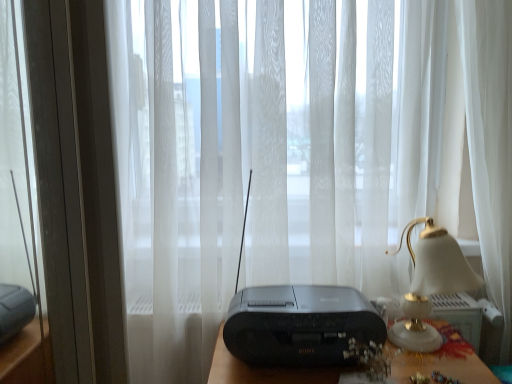
Find the location of a particular element. The height and width of the screenshot is (384, 512). matte gold lampshade at right is located at coordinates (430, 284).

You are a GUI agent. You are given a task and a screenshot of the screen. Output one action in this format:
    pyautogui.click(x=<x>, y=<y>)
    Task: Click on the black plastic radio at center
    This screenshot has width=512, height=384.
    Given the screenshot: What is the action you would take?
    pyautogui.click(x=298, y=322)

What is the approximate width of black plastic radio at center?

black plastic radio at center is 9.27 inches in width.

Where is `matte gold lampshade at right`? Image resolution: width=512 pixels, height=384 pixels. matte gold lampshade at right is located at coordinates (430, 284).

From the image's perspective, would you say matte gold lampshade at right is shown under black plastic radio at center?

Indeed, from the image's perspective, matte gold lampshade at right is shown beneath black plastic radio at center.

What's the angular difference between matte gold lampshade at right and black plastic radio at center's facing directions?

0.00258 degrees separate the facing orientations of matte gold lampshade at right and black plastic radio at center.

Considering the sizes of matte gold lampshade at right and black plastic radio at center in the image, is matte gold lampshade at right taller or shorter than black plastic radio at center?

Clearly, matte gold lampshade at right is shorter compared to black plastic radio at center.

Where is `gadget above the matte gold lampshade at right (from the image's perspective)`? The image size is (512, 384). gadget above the matte gold lampshade at right (from the image's perspective) is located at coordinates (298, 322).

Could you tell me if matte gold lampshade at right is turned towards transparent glass door at left?

No, matte gold lampshade at right is not turned towards transparent glass door at left.

Locate an element on the screen. table lamp located on the right of transparent glass door at left is located at coordinates (430, 284).

From the image's perspective, is black plastic radio at center positioned above or below matte gold lampshade at right?

Clearly, from the image's perspective, black plastic radio at center is above matte gold lampshade at right.

How many degrees apart are the facing directions of black plastic radio at center and matte gold lampshade at right?

The facing directions of black plastic radio at center and matte gold lampshade at right are 0.00258 degrees apart.

From a real-world perspective, is black plastic radio at center on top of matte gold lampshade at right?

Yes, from a real-world perspective, black plastic radio at center is over matte gold lampshade at right

In the image, there is a black plastic radio at center. Where is `table lamp below it (from a real-world perspective)`? The height and width of the screenshot is (384, 512). table lamp below it (from a real-world perspective) is located at coordinates [x=430, y=284].

Is transparent glass door at left positioned behind black plastic radio at center?

Yes, transparent glass door at left is further from the camera.

Considering the sizes of objects transparent glass door at left and black plastic radio at center in the image provided, who is taller, transparent glass door at left or black plastic radio at center?

Standing taller between the two is transparent glass door at left.

Does point (28, 153) come behind point (370, 305)?

No, it is in front of (370, 305).

Would you say matte gold lampshade at right is outside black plastic radio at center?

matte gold lampshade at right is positioned outside black plastic radio at center.

From the image's perspective, relative to black plastic radio at center, is matte gold lampshade at right above or below?

From the image's perspective, matte gold lampshade at right appears above black plastic radio at center.

Measure the distance from matte gold lampshade at right to black plastic radio at center.

The distance of matte gold lampshade at right from black plastic radio at center is 9.03 inches.

Identify the location of table lamp above the black plastic radio at center (from a real-world perspective). The height and width of the screenshot is (384, 512). (430, 284).

Is transparent glass door at left wider or thinner than black plastic radio at center?

transparent glass door at left is thinner than black plastic radio at center.

Would you say transparent glass door at left is inside or outside black plastic radio at center?

transparent glass door at left is outside black plastic radio at center.

Considering the relative sizes of transparent glass door at left and black plastic radio at center in the image provided, is transparent glass door at left smaller than black plastic radio at center?

No.

Can you confirm if black plastic radio at center is bigger than transparent glass door at left?

No.

From a real-world perspective, is black plastic radio at center physically located above or below transparent glass door at left?

In terms of real-world spatial position, black plastic radio at center is below transparent glass door at left.

Is black plastic radio at center at the left side of transparent glass door at left?

No.

Does black plastic radio at center have a greater width compared to transparent glass door at left?

Yes, black plastic radio at center is wider than transparent glass door at left.

The image size is (512, 384). What are the coordinates of `table lamp that is below the black plastic radio at center (from the image's perspective)` in the screenshot? It's located at (430, 284).

Image resolution: width=512 pixels, height=384 pixels. In order to click on table lamp that is on the right side of transparent glass door at left in this screenshot , I will do `click(430, 284)`.

Considering their positions, is transparent glass door at left positioned further to black plastic radio at center than matte gold lampshade at right?

transparent glass door at left.

When comparing their distances from black plastic radio at center, does black plastic radio at center or matte gold lampshade at right seem closer?

black plastic radio at center is closer to black plastic radio at center.

Which object lies further to the anchor point matte gold lampshade at right, black plastic radio at center or transparent glass door at left?

transparent glass door at left lies further to matte gold lampshade at right than the other object.

Based on the photo, when comparing their distances from black plastic radio at center, does matte gold lampshade at right or black plastic radio at center seem further?

matte gold lampshade at right is positioned further to the anchor black plastic radio at center.

Considering their positions, is black plastic radio at center positioned closer to matte gold lampshade at right than transparent glass door at left?

Based on the image, black plastic radio at center appears to be nearer to matte gold lampshade at right.

From the image, which object appears to be nearer to matte gold lampshade at right, transparent glass door at left or black plastic radio at center?

black plastic radio at center is positioned closer to the anchor matte gold lampshade at right.

Looking at the image, which one is located further to black plastic radio at center, transparent glass door at left or black plastic radio at center?

transparent glass door at left.

Which object lies further to the anchor point black plastic radio at center, matte gold lampshade at right or black plastic radio at center?

The object further to black plastic radio at center is matte gold lampshade at right.

This screenshot has height=384, width=512. What are the coordinates of `gadget between transparent glass door at left and matte gold lampshade at right from left to right` in the screenshot? It's located at (298, 322).

The height and width of the screenshot is (384, 512). Identify the location of printer between transparent glass door at left and black plastic radio at center. (300, 325).

I want to click on gadget between black plastic radio at center and matte gold lampshade at right from left to right, so [298, 322].

Find the location of a particular element. This screenshot has height=384, width=512. printer situated between transparent glass door at left and matte gold lampshade at right from left to right is located at coordinates (300, 325).